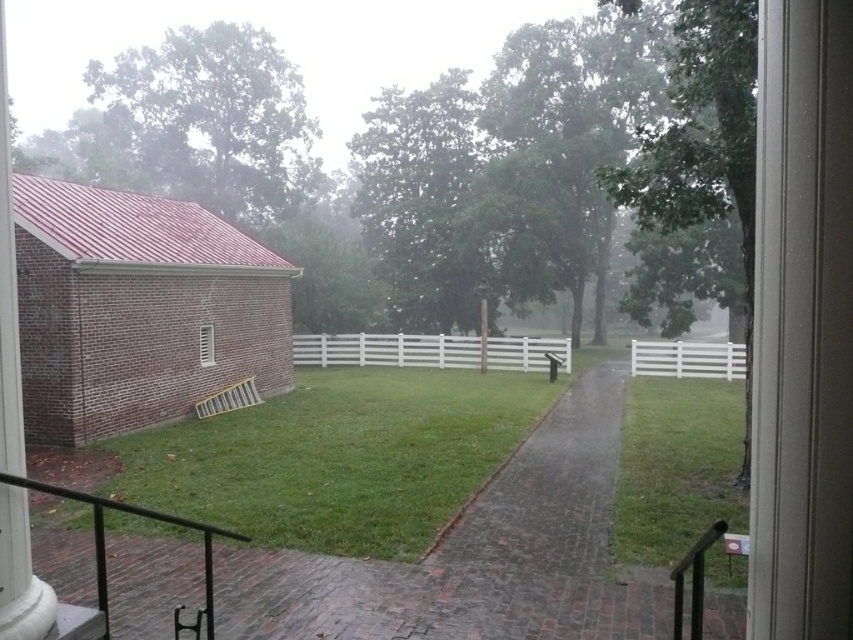
Question: From the image, what is the correct spatial relationship of green grass at center in relation to brick paved path at center?

Choices:
 (A) below
 (B) above

Answer: (B)

Question: Which point is farther to the camera?

Choices:
 (A) brick paved path at center
 (B) white painted wood window at lower left
 (C) green grass at center

Answer: (B)

Question: Can you confirm if green grass at center is wider than white painted wood window at lower left?

Choices:
 (A) yes
 (B) no

Answer: (A)

Question: Which object is positioned closest to the white painted wood window at lower left?

Choices:
 (A) brick paved path at center
 (B) green grass at center

Answer: (B)

Question: From the image, what is the correct spatial relationship of green grass at center in relation to brick paved path at center?

Choices:
 (A) left
 (B) right

Answer: (A)

Question: Which of the following is the farthest from the observer?

Choices:
 (A) white painted wood window at lower left
 (B) brick paved path at center

Answer: (A)